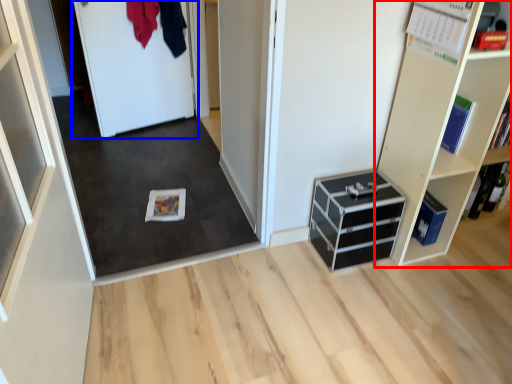
Question: Which object is further to the camera taking this photo, shelf (highlighted by a red box) or door (highlighted by a blue box)?

Choices:
 (A) shelf
 (B) door

Answer: (B)